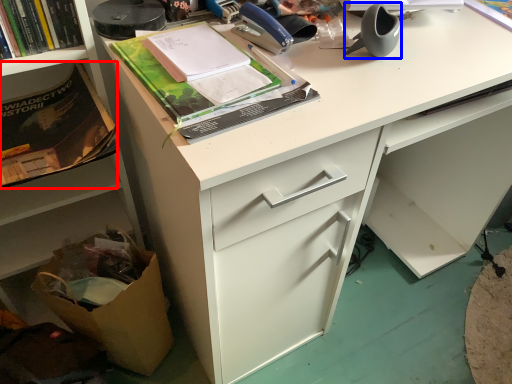
Question: Which of the following is the closest to the observer, paperback book (highlighted by a red box) or office supplies (highlighted by a blue box)?

Choices:
 (A) paperback book
 (B) office supplies

Answer: (B)